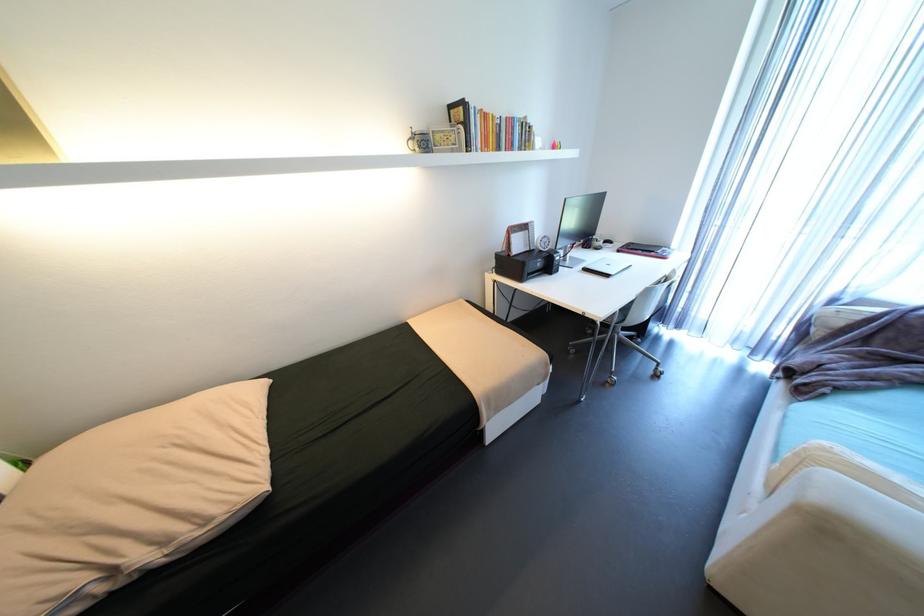
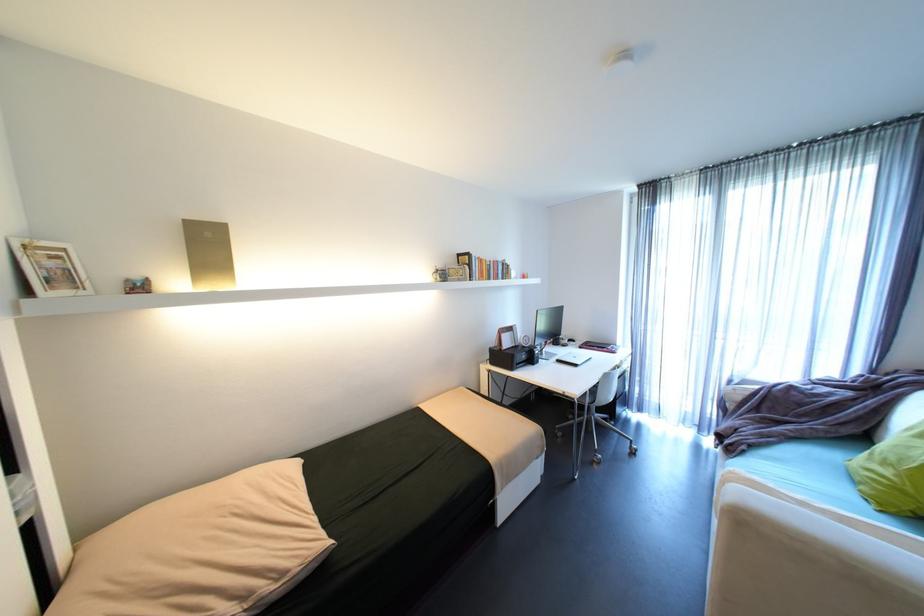
The point at (660, 252) is marked in the first image. Where is the corresponding point in the second image?

(612, 347)